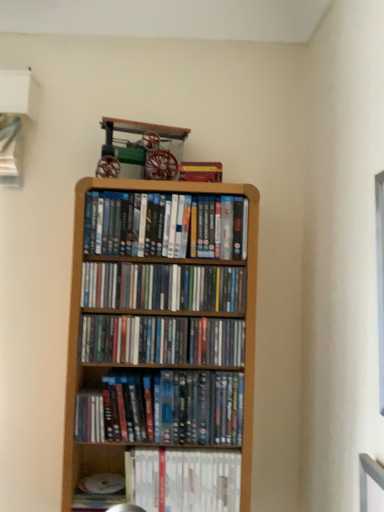
Question: Is matte plastic dvds at center, which is counted as the 1th book, starting from the top, positioned before wooden shelf at center, arranged as the second book when viewed from the top?

Choices:
 (A) yes
 (B) no

Answer: (B)

Question: Are matte plastic dvds at center, which is counted as the 5th book, starting from the bottom, and wooden shelf at center, arranged as the second book when viewed from the top, located far from each other?

Choices:
 (A) yes
 (B) no

Answer: (B)

Question: Is matte plastic dvds at center, which is counted as the 5th book, starting from the bottom, oriented away from wooden shelf at center, the 4th book positioned from the bottom?

Choices:
 (A) no
 (B) yes

Answer: (A)

Question: From a real-world perspective, is matte plastic dvds at center, which is counted as the 1th book, starting from the top, positioned over wooden shelf at center, the 4th book positioned from the bottom, based on gravity?

Choices:
 (A) no
 (B) yes

Answer: (B)

Question: Can you confirm if matte plastic dvds at center, which is counted as the 5th book, starting from the bottom, is shorter than wooden shelf at center, arranged as the second book when viewed from the top?

Choices:
 (A) yes
 (B) no

Answer: (B)

Question: In the image, is matte plastic dvds at center, which is the third book from bottom to top, positioned in front of or behind matte plastic dvds at center, which is counted as the 5th book, starting from the bottom?

Choices:
 (A) behind
 (B) front

Answer: (B)

Question: Do you think matte plastic dvds at center, which is the third book from bottom to top, is within matte plastic dvds at center, which is counted as the 5th book, starting from the bottom, or outside of it?

Choices:
 (A) outside
 (B) inside

Answer: (A)

Question: Is matte plastic dvds at center, which is the third book from bottom to top, wider or thinner than matte plastic dvds at center, which is counted as the 5th book, starting from the bottom?

Choices:
 (A) thin
 (B) wide

Answer: (A)

Question: Would you say matte plastic dvds at center, acting as the third book starting from the top, is to the left or to the right of matte plastic dvds at center, which is counted as the 1th book, starting from the top, in the picture?

Choices:
 (A) left
 (B) right

Answer: (A)

Question: Choose the correct answer: Is matte plastic dvds at center, acting as the third book starting from the top, inside wooden bookcase at center or outside it?

Choices:
 (A) inside
 (B) outside

Answer: (A)

Question: From the image's perspective, relative to wooden bookcase at center, is matte plastic dvds at center, acting as the third book starting from the top, above or below?

Choices:
 (A) above
 (B) below

Answer: (A)

Question: Is matte plastic dvds at center, acting as the third book starting from the top, wider or thinner than wooden bookcase at center?

Choices:
 (A) wide
 (B) thin

Answer: (B)

Question: Based on their sizes in the image, would you say matte plastic dvds at center, which is the third book from bottom to top, is bigger or smaller than wooden bookcase at center?

Choices:
 (A) big
 (B) small

Answer: (B)

Question: Based on their sizes in the image, would you say matte plastic dvds at center, which is counted as the 5th book, starting from the bottom, is bigger or smaller than matte plastic dvds at center, which is the third book from bottom to top?

Choices:
 (A) big
 (B) small

Answer: (A)

Question: Considering the positions of point (140, 207) and point (241, 345), is point (140, 207) closer or farther from the camera than point (241, 345)?

Choices:
 (A) farther
 (B) closer

Answer: (A)